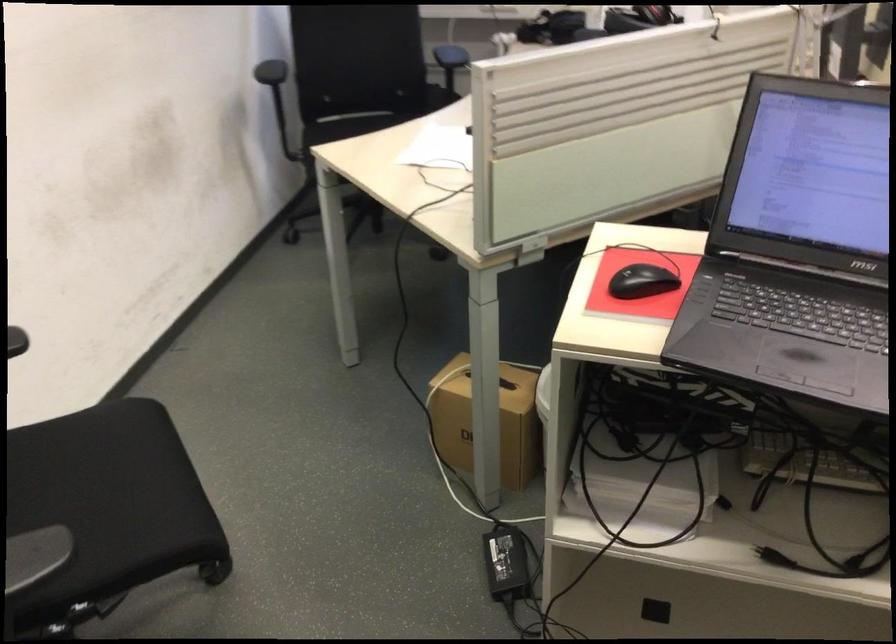
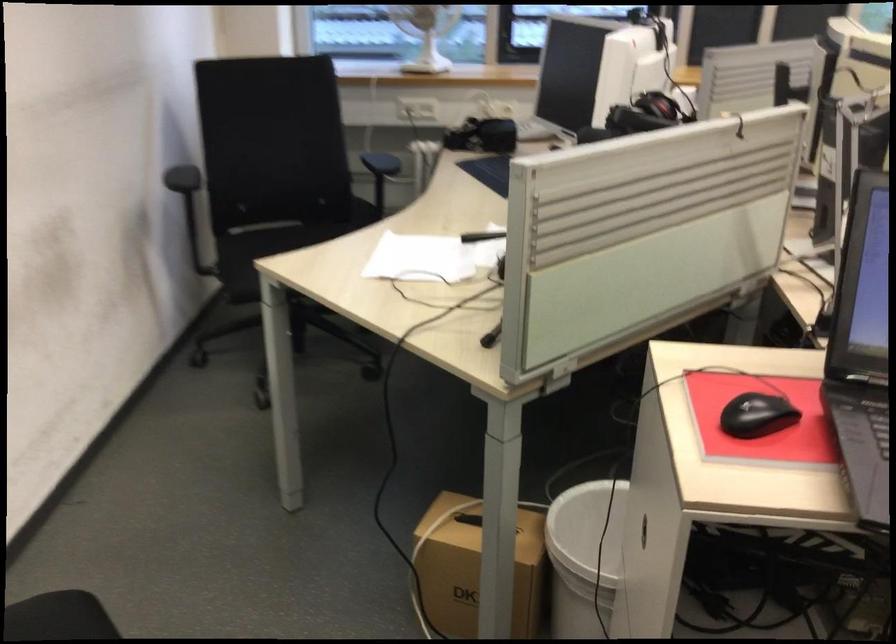
The images are taken continuously from a first-person perspective. In which direction are you moving?

The movement direction of the cameraman is left, forward.